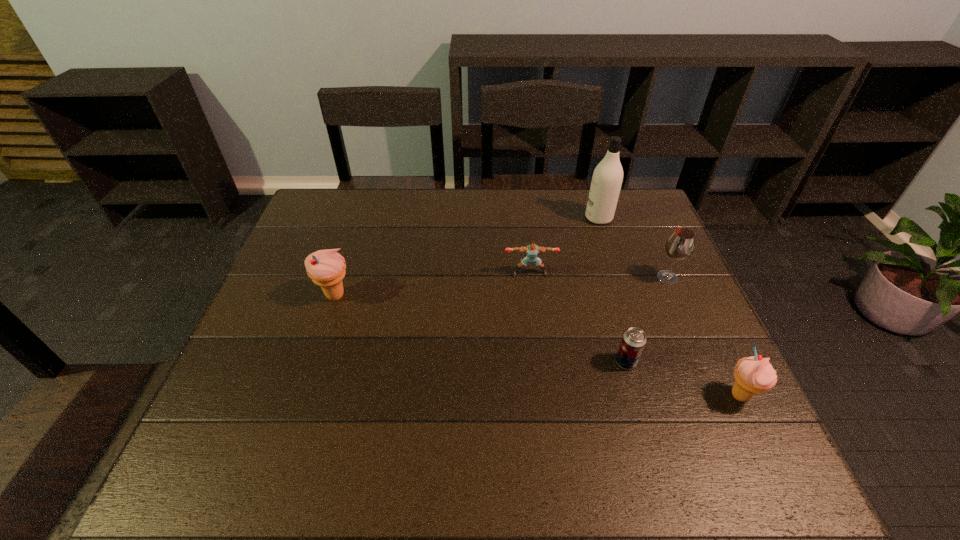
Please point a location where one more icecream can be added evenly. Please provide its 2D coordinates. Your answer should be formatted as a tuple, i.e. [(x, y)], where the tuple contains the x and y coordinates of a point satisfying the conditions above.

[(517, 341)]